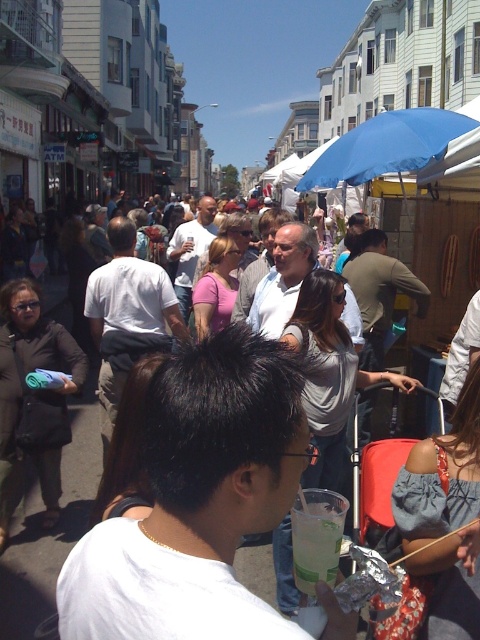
You are a street performer who needs to carry both the white plastic cup at center and the blue fabric umbrella at upper right. Which object is taller so that you can decide which to hold higher to avoid spilling the drink?

The blue fabric umbrella at upper right is taller than the white plastic cup at center, so you should hold the white plastic cup at center higher to avoid spilling the drink.

You are a photographer standing on the street and want to capture a photo of the white cotton shirt at center and the clear plastic cup at center. Which object should you focus on first if you want to ensure both are in sharp focus?

The white cotton shirt at center is located below the clear plastic cup at center. Since the shirt is lower in the frame, you should focus on the clear plastic cup at center first to ensure both are in sharp focus as the cup is closer to the camera.